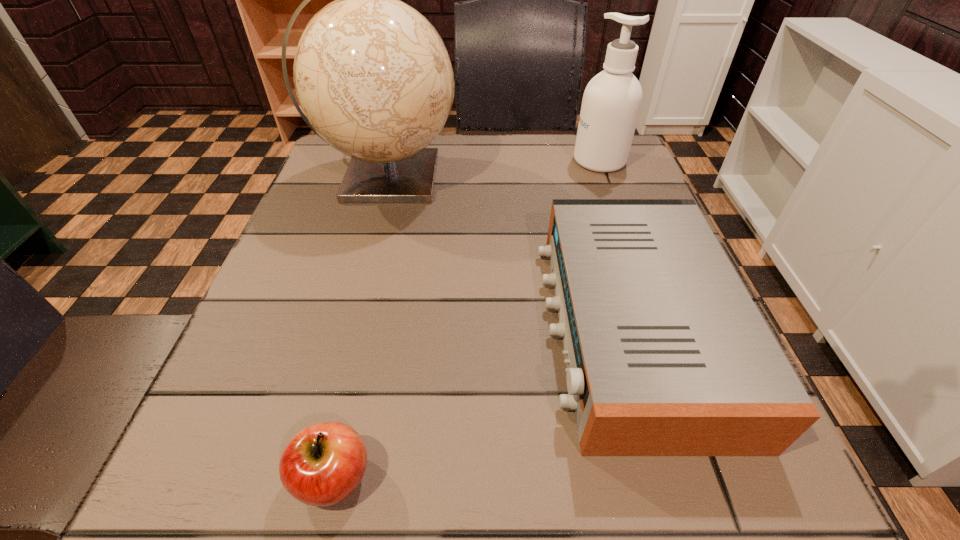
The width and height of the screenshot is (960, 540). Identify the location of free spot that satisfies the following two spatial constraints: 1. on the surface of the globe showing Europe and Africa; 2. on the left side of the apple. (304, 477).

I want to click on free space that satisfies the following two spatial constraints: 1. on the control panel of the radio receiver; 2. on the front side of the apple, so click(678, 477).